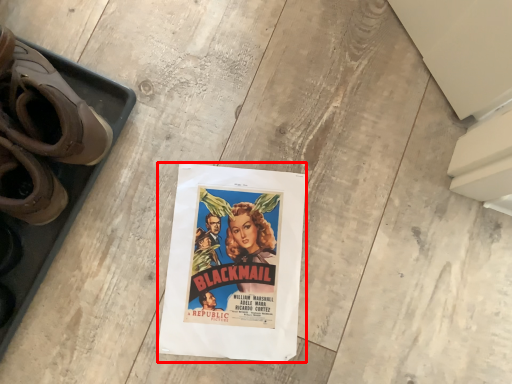
Question: From the image's perspective, where is poster (annotated by the red box) located in relation to footwear in the image?

Choices:
 (A) above
 (B) below

Answer: (B)